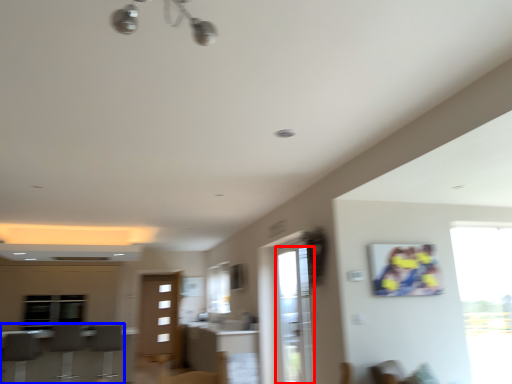
Question: Which point is closer to the camera, screen door (highlighted by a red box) or furniture (highlighted by a blue box)?

Choices:
 (A) screen door
 (B) furniture

Answer: (A)